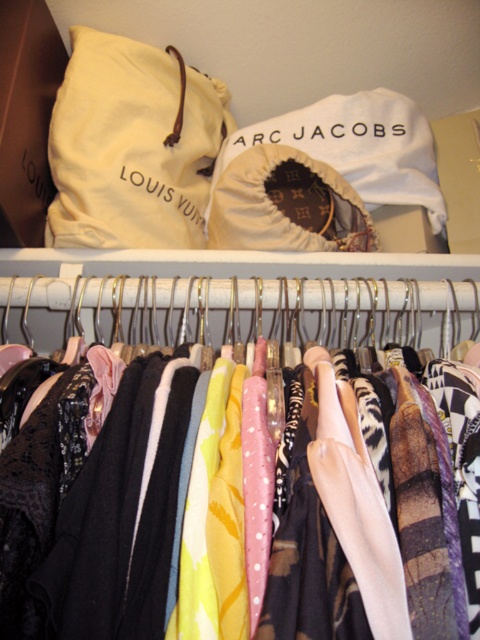
Question: Does silky fabric dresses at center appear over beige fabric bag at upper left?

Choices:
 (A) no
 (B) yes

Answer: (A)

Question: Which point appears closest to the camera in this image?

Choices:
 (A) (336, 452)
 (B) (108, 236)

Answer: (A)

Question: Which of the following is the closest to the observer?

Choices:
 (A) beige fabric bag at upper left
 (B) silky fabric dresses at center

Answer: (B)

Question: Does silky fabric dresses at center have a lesser width compared to beige fabric bag at upper left?

Choices:
 (A) yes
 (B) no

Answer: (B)

Question: Can you confirm if silky fabric dresses at center is bigger than beige fabric bag at upper left?

Choices:
 (A) yes
 (B) no

Answer: (A)